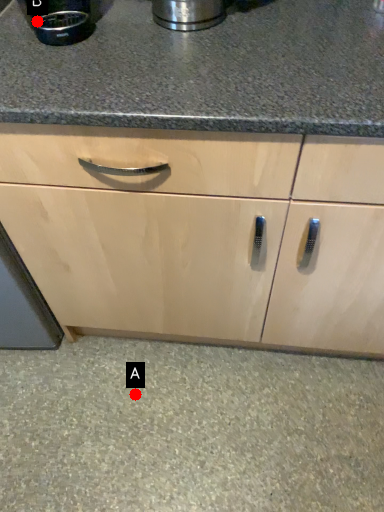
Question: Two points are circled on the image, labeled by A and B beside each circle. Which point is closer to the camera?

Choices:
 (A) A is closer
 (B) B is closer

Answer: (B)